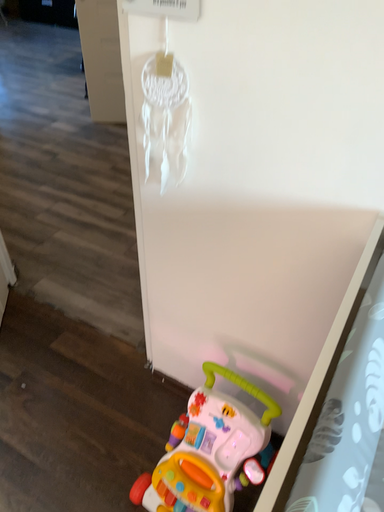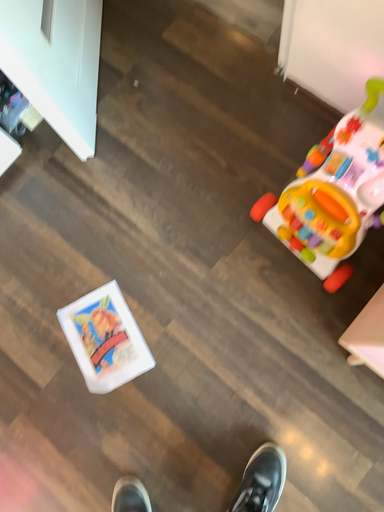
Question: Which way did the camera rotate in the video?

Choices:
 (A) rotated downward
 (B) rotated upward

Answer: (A)